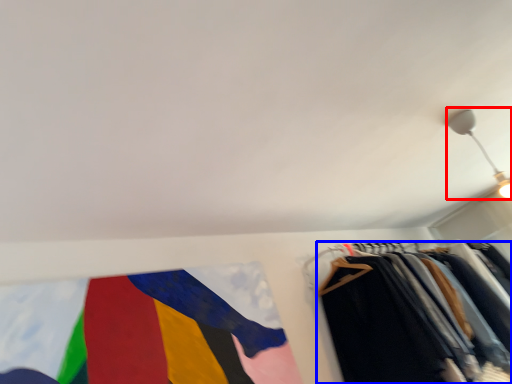
Question: Among these objects, which one is farthest to the camera, light fixture (highlighted by a red box) or trousers (highlighted by a blue box)?

Choices:
 (A) light fixture
 (B) trousers

Answer: (A)